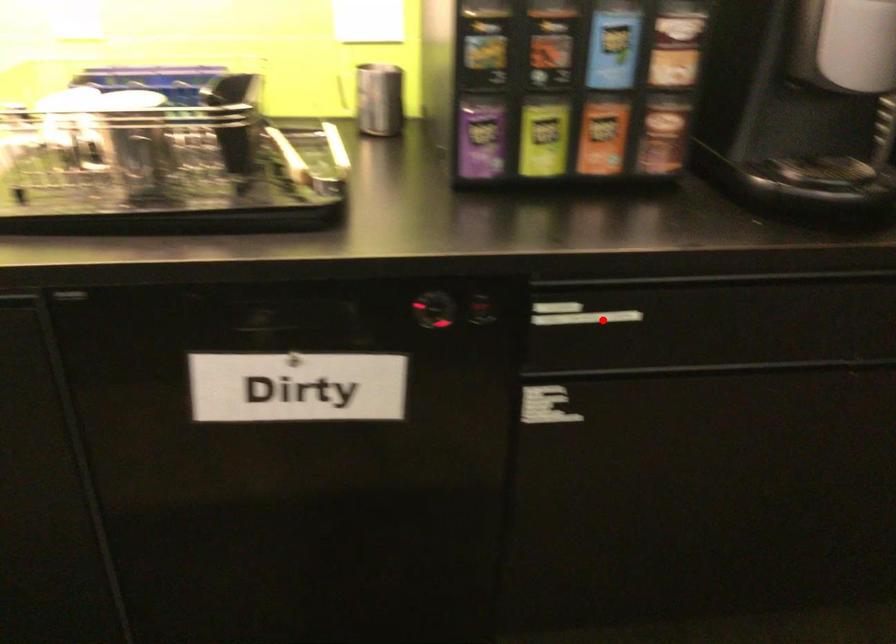
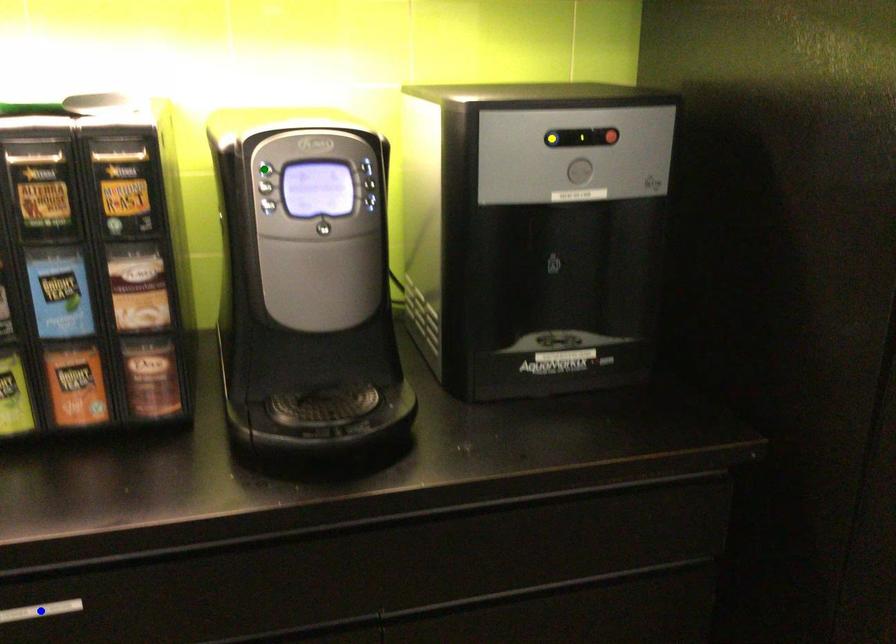
Question: I am providing you with two images of the same scene from different viewpoints. A red point is marked on the first image. You are given multiple points on the second image. Which point in image 2 is actually the same real-world point as the red point in image 1?

Choices:
 (A) yellow point
 (B) green point
 (C) blue point

Answer: (C)